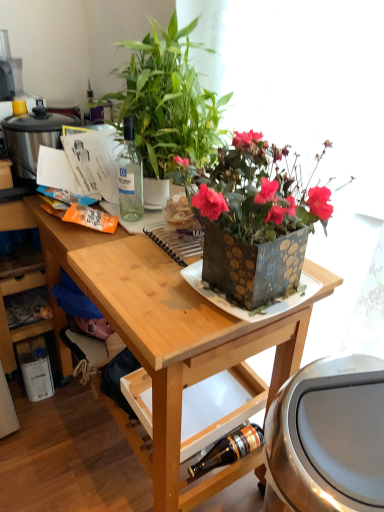
Question: Is transparent glass bottle at upper left, the 2th bottle from the right, wider or thinner than brushed metal trash can at lower right, the first appliance when ordered from right to left?

Choices:
 (A) thin
 (B) wide

Answer: (A)

Question: Considering the positions of point (135, 176) and point (301, 499), is point (135, 176) closer or farther from the camera than point (301, 499)?

Choices:
 (A) closer
 (B) farther

Answer: (B)

Question: Based on their relative distances, which object is nearer to the metallic square plate at center?

Choices:
 (A) green glossy plant at upper center
 (B) wooden desk at center
 (C) brown glass bottle at lower center, marked as the second bottle in a left-to-right arrangement
 (D) stainless steel rice cooker at left, which is the second appliance in front-to-back order
 (E) brushed metal trash can at lower right, placed as the second appliance when sorted from left to right

Answer: (B)

Question: Estimate the real-world distances between objects in this image. Which object is closer to the brushed metal trash can at lower right, which is the 1th appliance from bottom to top?

Choices:
 (A) brown glass bottle at lower center, marked as the second bottle in a left-to-right arrangement
 (B) wooden desk at center
 (C) stainless steel rice cooker at left, marked as the second appliance in a right-to-left arrangement
 (D) transparent glass bottle at upper left, the 2th bottle from the bottom
 (E) green glossy plant at upper center

Answer: (B)